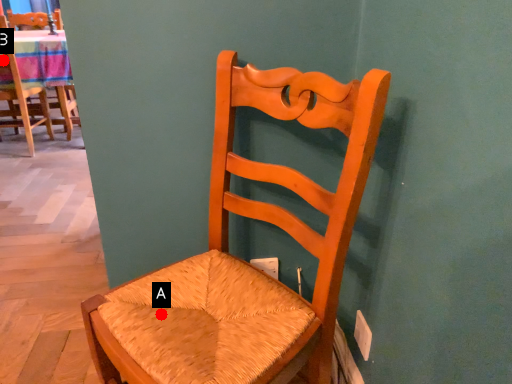
Question: Two points are circled on the image, labeled by A and B beside each circle. Which point is further to the camera?

Choices:
 (A) A is further
 (B) B is further

Answer: (B)